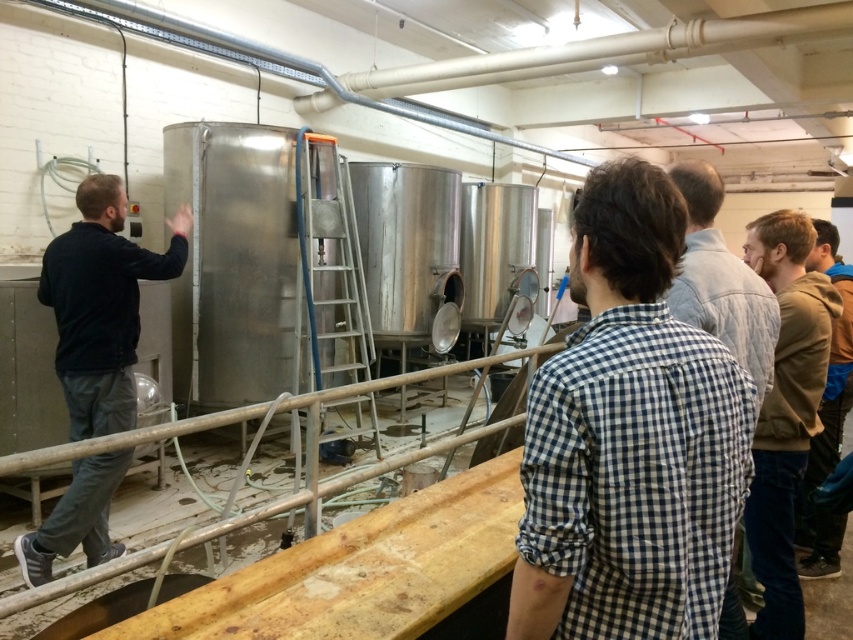
Consider the image. Can you confirm if green sweater at center is taller than checkered shirt at center?

Yes, green sweater at center is taller than checkered shirt at center.

Can you confirm if green sweater at center is smaller than checkered shirt at center?

No.

Does point (757, 515) come closer to viewer compared to point (734, 312)?

That is False.

Locate an element on the screen. green sweater at center is located at coordinates (785, 412).

Does checkered fabric shirt at center have a greater width compared to brown leather jacket at lower right?

Incorrect, checkered fabric shirt at center's width does not surpass brown leather jacket at lower right's.

Based on the photo, between checkered fabric shirt at center and brown leather jacket at lower right, which one is positioned lower?

brown leather jacket at lower right is lower down.

This screenshot has width=853, height=640. In order to click on checkered fabric shirt at center in this screenshot , I will do `click(630, 436)`.

Who is higher up, checkered fabric shirt at center or green sweater at center?

checkered fabric shirt at center is above.

In the scene shown: Can you confirm if checkered fabric shirt at center is taller than green sweater at center?

Incorrect, checkered fabric shirt at center's height is not larger of green sweater at center's.

You are a GUI agent. You are given a task and a screenshot of the screen. Output one action in this format:
    pyautogui.click(x=<x>, y=<y>)
    Task: Click on the checkered fabric shirt at center
    The width and height of the screenshot is (853, 640).
    Given the screenshot: What is the action you would take?
    (x=630, y=436)